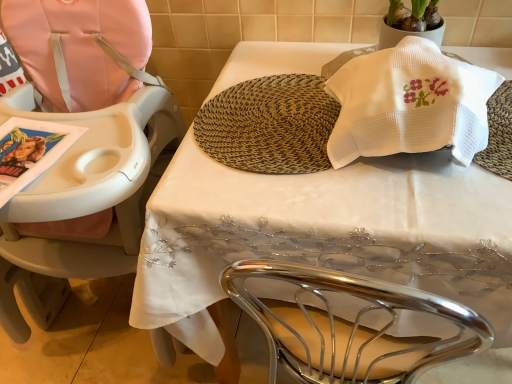
Locate an element on the screen. This screenshot has height=384, width=512. free point above brown woven mat at center (from a real-world perspective) is located at coordinates (274, 112).